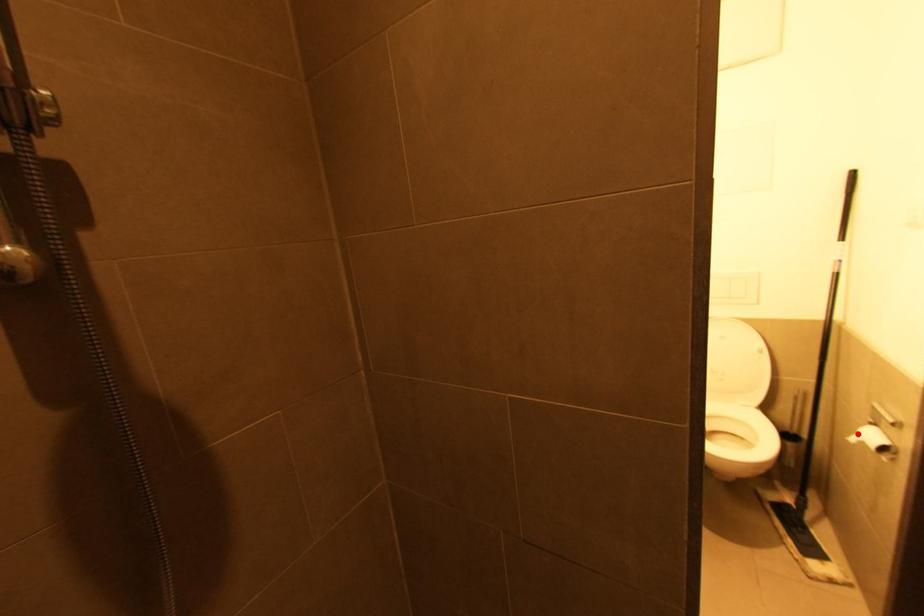
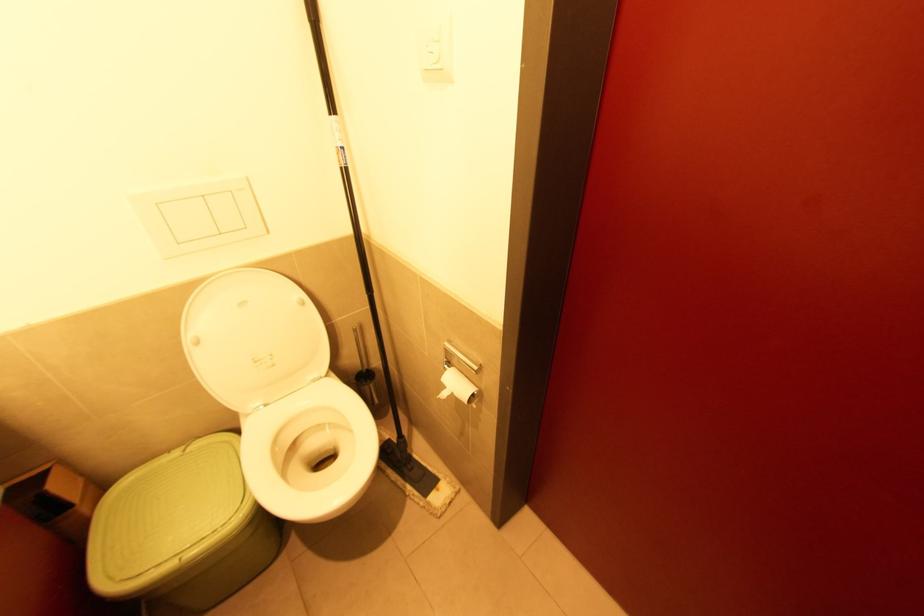
Question: I am providing you with two images of the same scene from different viewpoints. A red point is marked on the first image. Can you still see the location of the red point in image 2?

Choices:
 (A) Yes
 (B) No

Answer: (A)